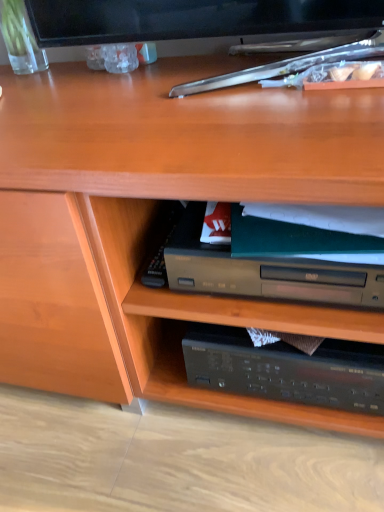
Question: Is clear glass vase at upper left next to green matte paperback book at center and touching it?

Choices:
 (A) yes
 (B) no

Answer: (B)

Question: Does clear glass vase at upper left have a larger size compared to green matte paperback book at center?

Choices:
 (A) no
 (B) yes

Answer: (A)

Question: Is clear glass vase at upper left thinner than green matte paperback book at center?

Choices:
 (A) no
 (B) yes

Answer: (B)

Question: From a real-world perspective, is clear glass vase at upper left positioned under green matte paperback book at center based on gravity?

Choices:
 (A) no
 (B) yes

Answer: (A)

Question: Does clear glass vase at upper left have a smaller size compared to green matte paperback book at center?

Choices:
 (A) no
 (B) yes

Answer: (B)

Question: Does clear glass vase at upper left turn towards green matte paperback book at center?

Choices:
 (A) no
 (B) yes

Answer: (A)

Question: Is green matte paperback book at center shorter than clear glass vase at upper left?

Choices:
 (A) yes
 (B) no

Answer: (A)

Question: Is green matte paperback book at center outside of clear glass vase at upper left?

Choices:
 (A) no
 (B) yes

Answer: (B)

Question: Is green matte paperback book at center at the left side of clear glass vase at upper left?

Choices:
 (A) no
 (B) yes

Answer: (A)

Question: From a real-world perspective, is green matte paperback book at center under clear glass vase at upper left?

Choices:
 (A) yes
 (B) no

Answer: (A)

Question: Is clear glass vase at upper left inside green matte paperback book at center?

Choices:
 (A) no
 (B) yes

Answer: (A)

Question: Is green matte paperback book at center far away from clear glass vase at upper left?

Choices:
 (A) no
 (B) yes

Answer: (A)

Question: Does point (18, 44) appear closer or farther from the camera than point (334, 297)?

Choices:
 (A) farther
 (B) closer

Answer: (A)